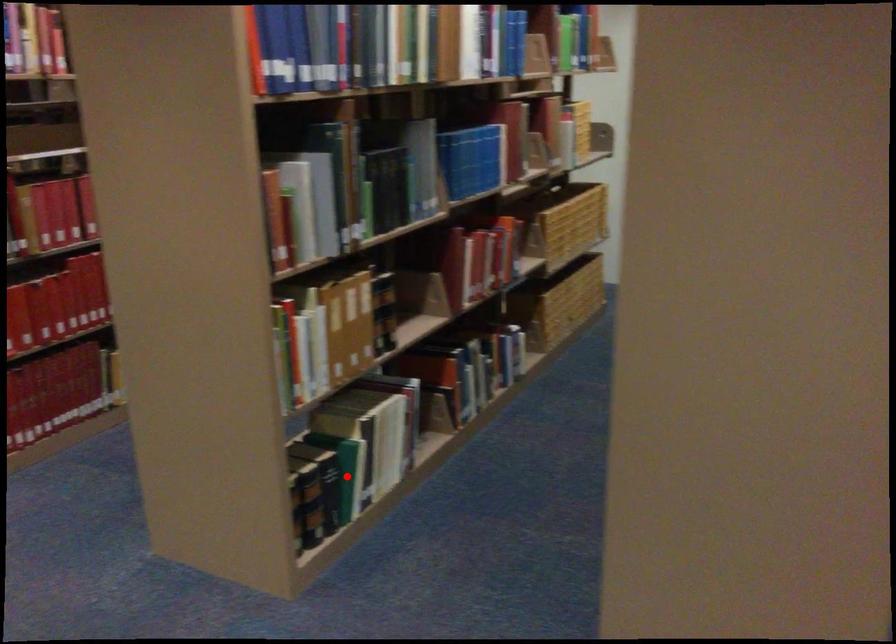
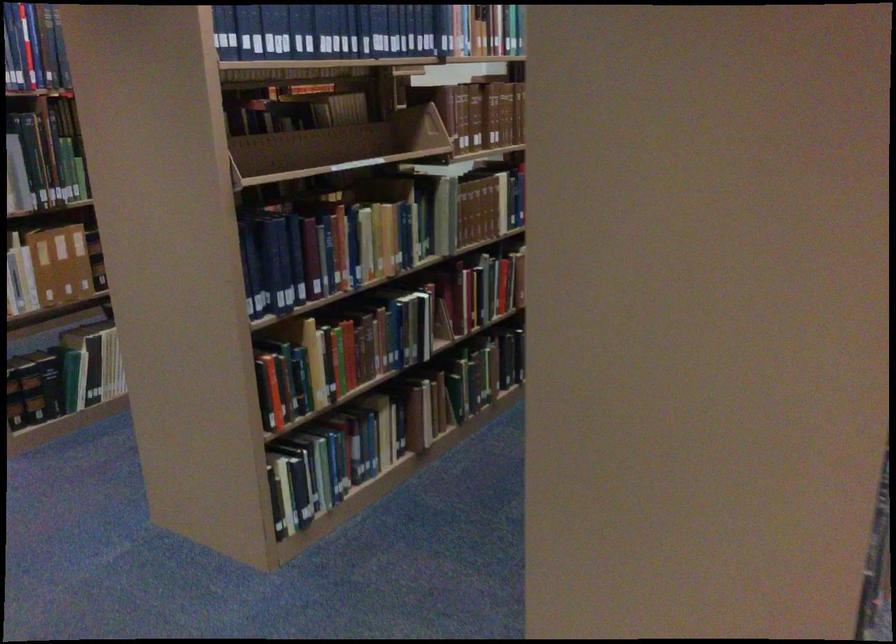
Question: I am providing you with two images of the same scene from different viewpoints. In image1, a red point is highlighted. Considering the same 3D point in image2, which of the following is correct?

Choices:
 (A) It is closer
 (B) It is farther

Answer: (B)